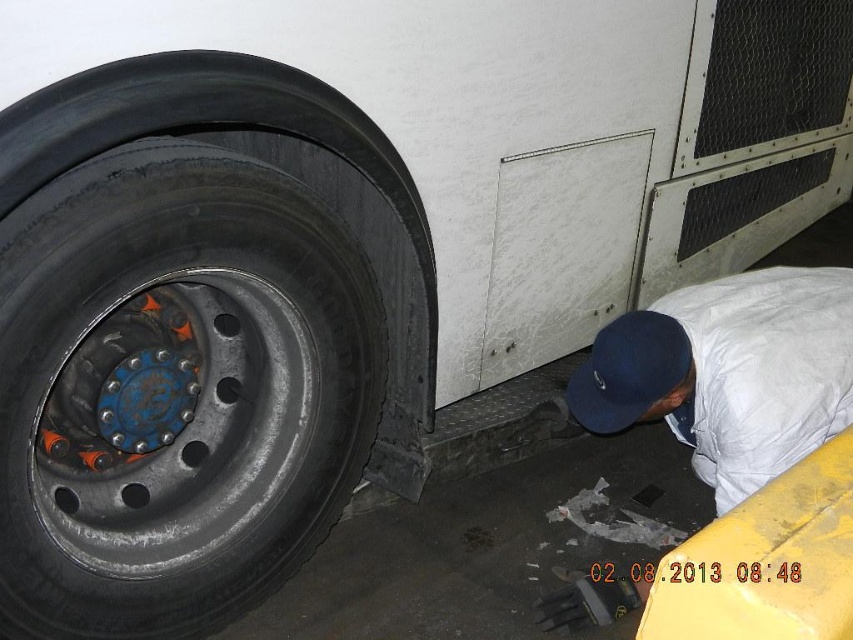
Question: Among these objects, which one is nearest to the camera?

Choices:
 (A) blue metallic rim at lower left
 (B) white fabric at lower right

Answer: (A)

Question: Which is nearer to the blue fabric baseball cap at lower right?

Choices:
 (A) white fabric at lower right
 (B) blue metallic rim at lower left

Answer: (A)

Question: Does blue metallic rim at lower left have a greater width compared to white fabric at lower right?

Choices:
 (A) yes
 (B) no

Answer: (B)

Question: Can you confirm if blue metallic rim at lower left is smaller than white fabric at lower right?

Choices:
 (A) no
 (B) yes

Answer: (A)

Question: Does blue metallic rim at lower left have a smaller size compared to blue fabric baseball cap at lower right?

Choices:
 (A) yes
 (B) no

Answer: (B)

Question: Which object appears closest to the camera in this image?

Choices:
 (A) blue metallic rim at lower left
 (B) blue fabric baseball cap at lower right
 (C) white fabric at lower right

Answer: (A)